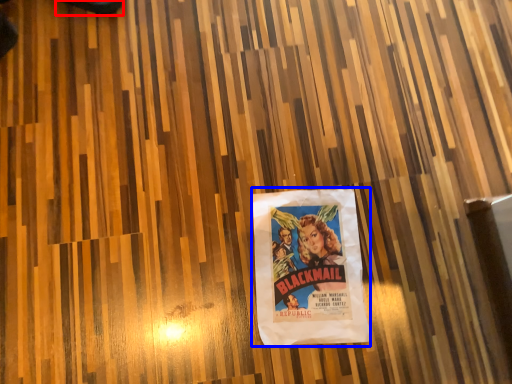
Question: Among these objects, which one is nearest to the camera, shoe (highlighted by a red box) or poster (highlighted by a blue box)?

Choices:
 (A) shoe
 (B) poster

Answer: (B)